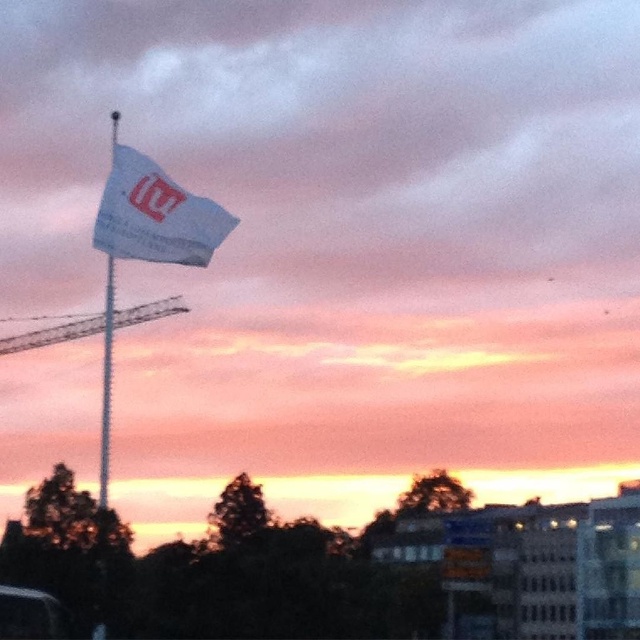
Question: In this image, where is white fabric flag at upper center located relative to white fabric flagpole at upper left?

Choices:
 (A) above
 (B) below

Answer: (A)

Question: Which object is the closest to the metallic gray crane at left?

Choices:
 (A) white fabric flag at upper center
 (B) white fabric flagpole at upper left

Answer: (B)

Question: Considering the real-world distances, which object is farthest from the white fabric flag at upper center?

Choices:
 (A) metallic gray crane at left
 (B) white fabric flagpole at upper left

Answer: (A)

Question: In this image, where is white fabric flag at upper center located relative to metallic gray crane at left?

Choices:
 (A) left
 (B) right

Answer: (B)

Question: Is white fabric flag at upper center bigger than white fabric flagpole at upper left?

Choices:
 (A) yes
 (B) no

Answer: (B)

Question: Which object appears closest to the camera in this image?

Choices:
 (A) metallic gray crane at left
 (B) white fabric flag at upper center
 (C) white fabric flagpole at upper left

Answer: (B)